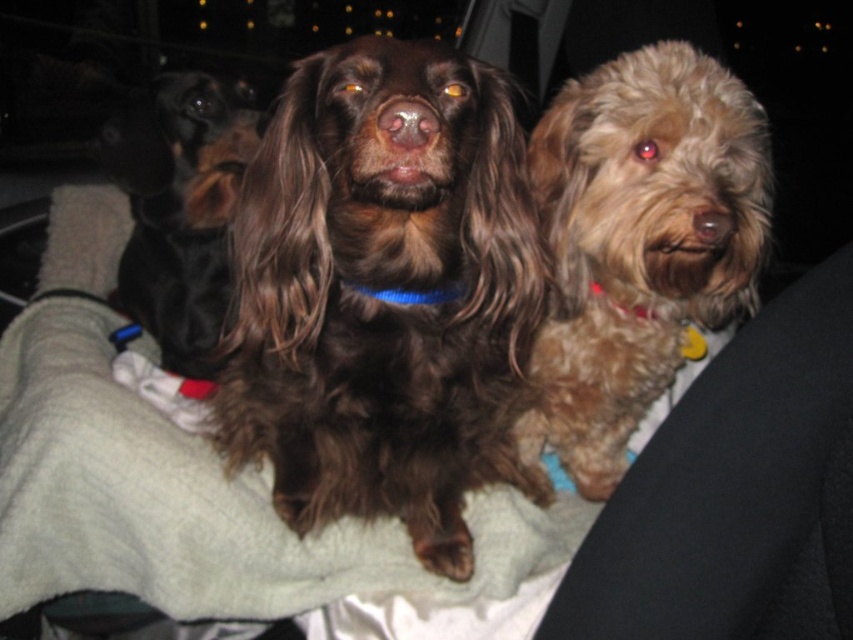
Question: Which point is farther to the camera?

Choices:
 (A) fuzzy brown dog at center
 (B) black shiny dog at left
 (C) brown furry dog at center

Answer: (B)

Question: Which point is farther to the camera?

Choices:
 (A) fuzzy brown dog at center
 (B) black shiny dog at left
 (C) brown furry dog at center
 (D) blue fabric neckband at center

Answer: (B)

Question: Which of the following is the farthest from the observer?

Choices:
 (A) (357, 77)
 (B) (604, 196)

Answer: (B)

Question: Is brown furry dog at center behind blue fabric neckband at center?

Choices:
 (A) yes
 (B) no

Answer: (B)

Question: In this image, where is brown furry dog at center located relative to fuzzy brown dog at center?

Choices:
 (A) below
 (B) above

Answer: (A)

Question: Does brown furry dog at center appear over fuzzy brown dog at center?

Choices:
 (A) yes
 (B) no

Answer: (B)